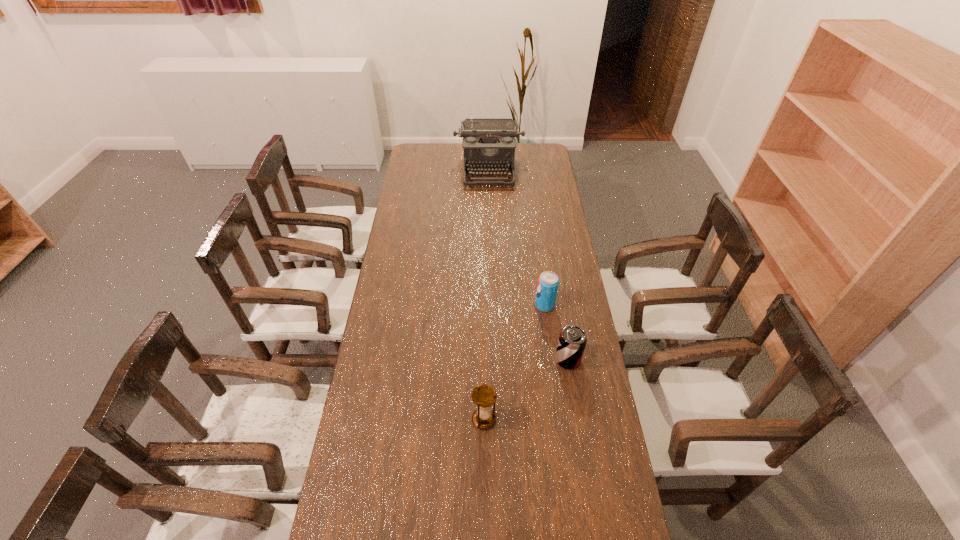
Find the location of `typewriter that is at the right edge`. typewriter that is at the right edge is located at coordinates (489, 143).

At what (x,y) coordinates should I click in order to perform the action: click on object that is positioned at the far right corner. Please return your answer as a coordinate pair (x, y). The image size is (960, 540). Looking at the image, I should click on (489, 143).

You are a GUI agent. You are given a task and a screenshot of the screen. Output one action in this format:
    pyautogui.click(x=<x>, y=<y>)
    Task: Click on the vacant space at the far edge
    The height and width of the screenshot is (540, 960).
    Given the screenshot: What is the action you would take?
    pyautogui.click(x=459, y=165)

In the image, there is a desktop. Find the location of `vacant space at the left edge`. vacant space at the left edge is located at coordinates (408, 280).

Where is `vacant area at the right edge of the desktop`? The width and height of the screenshot is (960, 540). vacant area at the right edge of the desktop is located at coordinates (561, 482).

Where is `free space at the far left corner`? The image size is (960, 540). free space at the far left corner is located at coordinates click(428, 161).

Find the location of a particular element. The image size is (960, 540). unoccupied area between the third farthest object and the farther soda can is located at coordinates (557, 333).

Where is `free spot between the tallest object and the third farthest object`? free spot between the tallest object and the third farthest object is located at coordinates (528, 265).

Where is `free area in between the nearer soda can and the tallest object`? free area in between the nearer soda can and the tallest object is located at coordinates (528, 265).

At what (x,y) coordinates should I click in order to perform the action: click on free space between the nearer soda can and the hourglass. Please return your answer as a coordinate pair (x, y). This screenshot has width=960, height=540. Looking at the image, I should click on (526, 389).